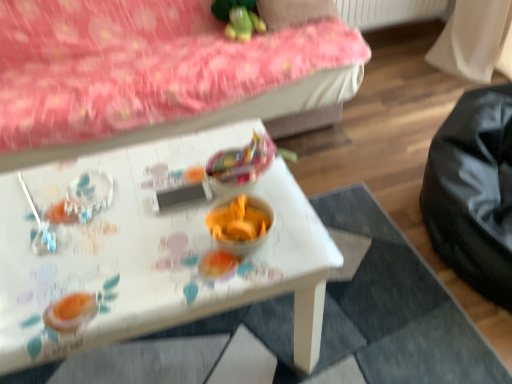
Find the location of a particular element. vacant area that is situated to the right of shiny plastic candy at center is located at coordinates pyautogui.click(x=284, y=190).